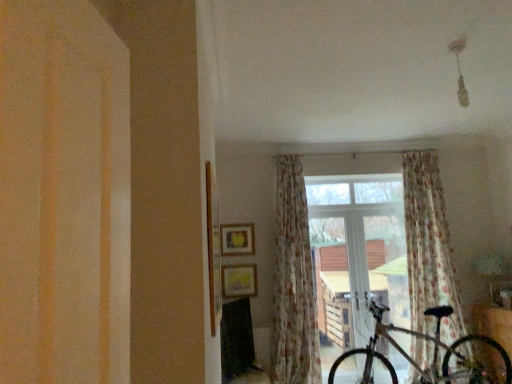
Measure the distance between point (231, 255) and camera.

Point (231, 255) and camera are 4.82 meters apart.

Locate an element on the screen. The width and height of the screenshot is (512, 384). floral fabric curtain at center, marked as the 2th curtain in a right-to-left arrangement is located at coordinates (293, 283).

What do you see at coordinates (293, 283) in the screenshot? I see `floral fabric curtain at center, marked as the 2th curtain in a right-to-left arrangement` at bounding box center [293, 283].

Find the location of `floral fabric curtain at center, the 1th curtain viewed from the right`. floral fabric curtain at center, the 1th curtain viewed from the right is located at coordinates (429, 245).

From a real-world perspective, which is physically below, floral fabric curtain at center, acting as the 1th curtain starting from the left, or matte yellow picture frame at center, which appears as the 2th picture frame when ordered from the bottom?

In real-world perspective, floral fabric curtain at center, acting as the 1th curtain starting from the left, is lower.

Is floral fabric curtain at center, marked as the 2th curtain in a right-to-left arrangement, directly adjacent to matte yellow picture frame at center, which appears as the 2th picture frame when ordered from the bottom?

No, floral fabric curtain at center, marked as the 2th curtain in a right-to-left arrangement, is not with matte yellow picture frame at center, which appears as the 2th picture frame when ordered from the bottom.

From the image's perspective, which is above, floral fabric curtain at center, acting as the 1th curtain starting from the left, or matte yellow picture frame at center, which appears as the 2th picture frame when ordered from the bottom?

matte yellow picture frame at center, which appears as the 2th picture frame when ordered from the bottom, is shown above in the image.

Does point (346, 247) come farther from viewer compared to point (416, 298)?

Yes, it is behind point (416, 298).

Is transparent glass window at center in front of or behind floral fabric curtain at center, arranged as the second curtain when viewed from the left, in the image?

Clearly, transparent glass window at center is behind floral fabric curtain at center, arranged as the second curtain when viewed from the left.

Is floral fabric curtain at center, arranged as the second curtain when viewed from the left, at the back of transparent glass window at center?

No.

In the scene shown: How far apart are floral fabric curtain at center, arranged as the second curtain when viewed from the left, and metallic silver bicycle at center?

floral fabric curtain at center, arranged as the second curtain when viewed from the left, is 3.68 feet from metallic silver bicycle at center.

Is floral fabric curtain at center, the 1th curtain viewed from the right, turned away from metallic silver bicycle at center?

No, metallic silver bicycle at center is not at the back of floral fabric curtain at center, the 1th curtain viewed from the right.

Which object is wider, floral fabric curtain at center, arranged as the second curtain when viewed from the left, or metallic silver bicycle at center?

Wider between the two is metallic silver bicycle at center.

This screenshot has height=384, width=512. Find the location of `bicycle on the left of floral fabric curtain at center, arranged as the second curtain when viewed from the left`. bicycle on the left of floral fabric curtain at center, arranged as the second curtain when viewed from the left is located at coordinates (410, 357).

Considering the relative positions of transparent glass window at center and metallic silver bicycle at center in the image provided, is transparent glass window at center to the left or to the right of metallic silver bicycle at center?

Clearly, transparent glass window at center is on the left of metallic silver bicycle at center in the image.

Based on the photo, are transparent glass window at center and metallic silver bicycle at center beside each other?

transparent glass window at center and metallic silver bicycle at center are clearly separated.

From the image's perspective, is transparent glass window at center positioned above or below metallic silver bicycle at center?

Based on their image positions, transparent glass window at center is located above metallic silver bicycle at center.

Find the location of a particular element. This screenshot has height=384, width=512. window that is in front of the matte yellow picture frame at center, the 1th picture frame when ordered from top to bottom is located at coordinates (358, 251).

Considering the sizes of objects matte yellow picture frame at center, which appears as the 2th picture frame when ordered from the bottom, and transparent glass window at center in the image provided, who is taller, matte yellow picture frame at center, which appears as the 2th picture frame when ordered from the bottom, or transparent glass window at center?

With more height is transparent glass window at center.

From a real-world perspective, who is located higher, matte yellow picture frame at center, the 1th picture frame when ordered from top to bottom, or transparent glass window at center?

matte yellow picture frame at center, the 1th picture frame when ordered from top to bottom, from a real-world perspective.

Does point (226, 252) lie behind point (390, 180)?

No, (226, 252) is closer to viewer.

Is transparent glass window at center completely or partially outside of matte yellow picture frame at center, the 2th picture frame in the top-to-bottom sequence?

Absolutely, transparent glass window at center is external to matte yellow picture frame at center, the 2th picture frame in the top-to-bottom sequence.

Locate an element on the screen. The image size is (512, 384). picture frame in front of the transparent glass window at center is located at coordinates (239, 281).

Is point (327, 246) positioned after point (234, 270)?

Yes, point (327, 246) is behind point (234, 270).

Which of these two, transparent glass window at center or matte yellow picture frame at center, marked as the 1th picture frame in a bottom-to-top arrangement, stands taller?

transparent glass window at center.

Could you measure the distance between floral fabric curtain at center, the 1th curtain viewed from the right, and floral fabric curtain at center, marked as the 2th curtain in a right-to-left arrangement?

floral fabric curtain at center, the 1th curtain viewed from the right, and floral fabric curtain at center, marked as the 2th curtain in a right-to-left arrangement, are 5.24 feet apart.

Can you confirm if floral fabric curtain at center, arranged as the second curtain when viewed from the left, is bigger than floral fabric curtain at center, marked as the 2th curtain in a right-to-left arrangement?

Yes.

Between floral fabric curtain at center, the 1th curtain viewed from the right, and floral fabric curtain at center, acting as the 1th curtain starting from the left, which one appears on the right side from the viewer's perspective?

floral fabric curtain at center, the 1th curtain viewed from the right.

From the image's perspective, does floral fabric curtain at center, arranged as the second curtain when viewed from the left, appear lower than floral fabric curtain at center, acting as the 1th curtain starting from the left?

No.

The width and height of the screenshot is (512, 384). Identify the location of picture frame above the floral fabric curtain at center, marked as the 2th curtain in a right-to-left arrangement (from a real-world perspective). (237, 239).

Locate an element on the screen. Image resolution: width=512 pixels, height=384 pixels. window below the floral fabric curtain at center, arranged as the second curtain when viewed from the left (from the image's perspective) is located at coordinates (358, 251).

Which object lies nearer to the anchor point floral fabric curtain at center, acting as the 1th curtain starting from the left, floral fabric curtain at center, arranged as the second curtain when viewed from the left, or transparent glass window at center?

transparent glass window at center is closer to floral fabric curtain at center, acting as the 1th curtain starting from the left.

When comparing their distances from metallic silver bicycle at center, does matte yellow picture frame at center, the 2th picture frame in the top-to-bottom sequence, or transparent glass window at center seem closer?

transparent glass window at center is positioned closer to the anchor metallic silver bicycle at center.

From the image, which object appears to be nearer to transparent glass window at center, floral fabric curtain at center, marked as the 2th curtain in a right-to-left arrangement, or metallic silver bicycle at center?

floral fabric curtain at center, marked as the 2th curtain in a right-to-left arrangement, is positioned closer to the anchor transparent glass window at center.

From the image, which object appears to be nearer to floral fabric curtain at center, arranged as the second curtain when viewed from the left, metallic silver bicycle at center or matte yellow picture frame at center, marked as the 1th picture frame in a bottom-to-top arrangement?

Among the two, metallic silver bicycle at center is located nearer to floral fabric curtain at center, arranged as the second curtain when viewed from the left.

Considering their positions, is floral fabric curtain at center, the 1th curtain viewed from the right, positioned closer to matte yellow picture frame at center, which appears as the 2th picture frame when ordered from the bottom, than matte yellow picture frame at center, the 2th picture frame in the top-to-bottom sequence?

matte yellow picture frame at center, the 2th picture frame in the top-to-bottom sequence.

Looking at the image, which one is located closer to floral fabric curtain at center, the 1th curtain viewed from the right, matte yellow picture frame at center, which appears as the 2th picture frame when ordered from the bottom, or metallic silver bicycle at center?

metallic silver bicycle at center is closer to floral fabric curtain at center, the 1th curtain viewed from the right.

Based on their spatial positions, is floral fabric curtain at center, the 1th curtain viewed from the right, or matte yellow picture frame at center, the 1th picture frame when ordered from top to bottom, further from floral fabric curtain at center, acting as the 1th curtain starting from the left?

floral fabric curtain at center, the 1th curtain viewed from the right, is further to floral fabric curtain at center, acting as the 1th curtain starting from the left.

Looking at the image, which one is located closer to metallic silver bicycle at center, transparent glass window at center or matte yellow picture frame at center, which appears as the 2th picture frame when ordered from the bottom?

Based on the image, transparent glass window at center appears to be nearer to metallic silver bicycle at center.

You are a GUI agent. You are given a task and a screenshot of the screen. Output one action in this format:
    pyautogui.click(x=<x>, y=<y>)
    Task: Click on the window located between matte yellow picture frame at center, which appears as the 2th picture frame when ordered from the bottom, and metallic silver bicycle at center in the left-right direction
    
    Given the screenshot: What is the action you would take?
    pyautogui.click(x=358, y=251)

Find the location of a particular element. curtain between matte yellow picture frame at center, which appears as the 2th picture frame when ordered from the bottom, and floral fabric curtain at center, arranged as the second curtain when viewed from the left is located at coordinates (293, 283).

Identify the location of window between matte yellow picture frame at center, the 2th picture frame in the top-to-bottom sequence, and metallic silver bicycle at center. The height and width of the screenshot is (384, 512). (358, 251).

Locate an element on the screen. picture frame between matte yellow picture frame at center, the 1th picture frame when ordered from top to bottom, and metallic silver bicycle at center, in the horizontal direction is located at coordinates (x=239, y=281).